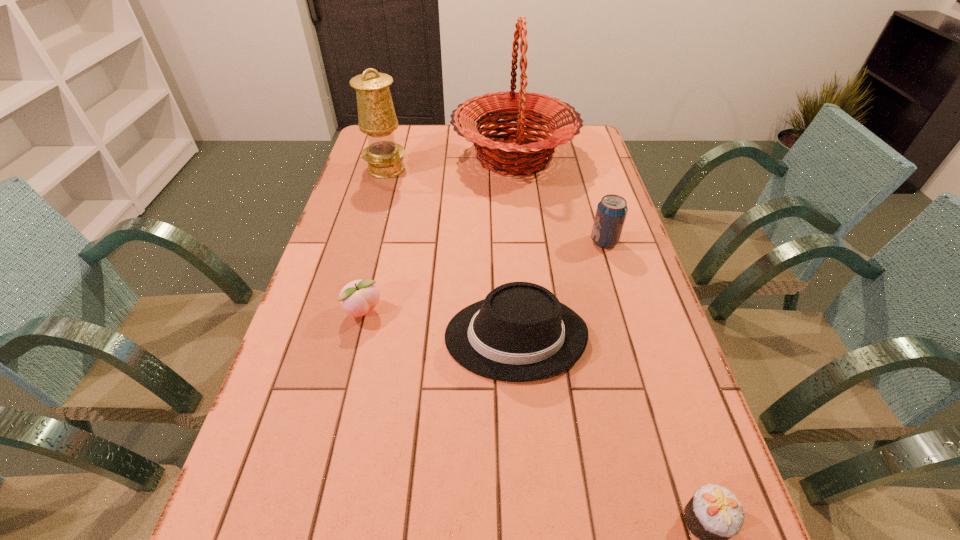
In order to click on free region at the right edge of the desktop in this screenshot , I will do point(674,351).

Where is `vacant space at the far right corner of the desktop`? vacant space at the far right corner of the desktop is located at coordinates (584, 130).

Where is `vacant area between the third shortest object and the fifth shortest object`? This screenshot has width=960, height=540. vacant area between the third shortest object and the fifth shortest object is located at coordinates (450, 253).

The height and width of the screenshot is (540, 960). What are the coordinates of `free space between the fourth tallest object and the oil lamp` in the screenshot? It's located at (450, 253).

I want to click on free spot between the third shortest object and the oil lamp, so click(x=450, y=253).

Identify the location of free space between the fifth shortest object and the tallest object. (450, 163).

You are a GUI agent. You are given a task and a screenshot of the screen. Output one action in this format:
    pyautogui.click(x=<x>, y=<y>)
    Task: Click on the free space between the fifth tallest object and the basket
    This screenshot has height=540, width=960.
    Given the screenshot: What is the action you would take?
    pyautogui.click(x=439, y=235)

Locate an element on the screen. The height and width of the screenshot is (540, 960). free spot between the basket and the fedora is located at coordinates (515, 247).

Choose which object is the third nearest neighbor to the third farthest object. Please provide its 2D coordinates. Your answer should be formatted as a tuple, i.e. [(x, y)], where the tuple contains the x and y coordinates of a point satisfying the conditions above.

[(357, 298)]

Point out which object is positioned as the fifth nearest to the fifth tallest object. Please provide its 2D coordinates. Your answer should be formatted as a tuple, i.e. [(x, y)], where the tuple contains the x and y coordinates of a point satisfying the conditions above.

[(714, 514)]